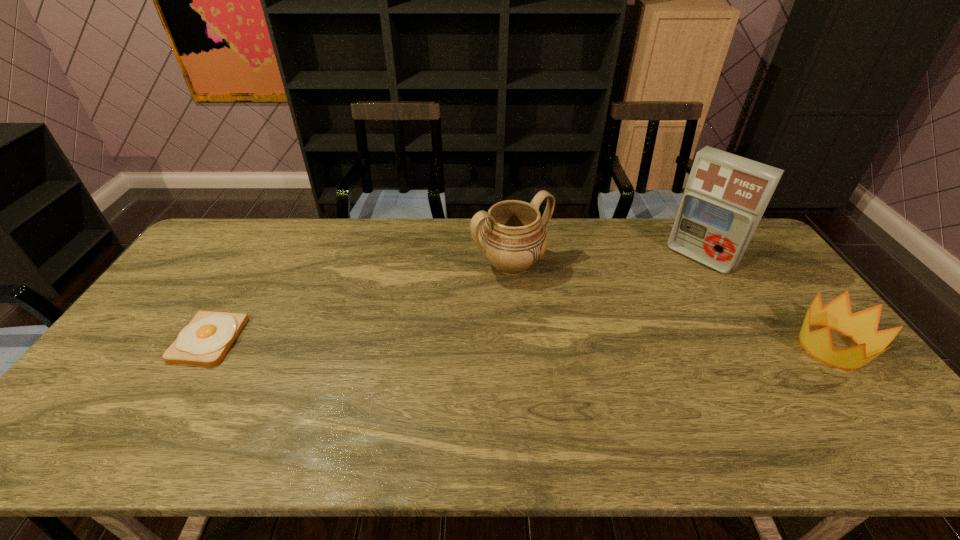
I want to click on empty space that is in between the crown and the third object from left to right, so click(x=766, y=302).

Image resolution: width=960 pixels, height=540 pixels. Find the location of `vacant space that's between the urn and the crown`. vacant space that's between the urn and the crown is located at coordinates click(x=671, y=306).

The height and width of the screenshot is (540, 960). I want to click on free spot between the shortest object and the second object from right to left, so click(454, 299).

Where is `vacant area that lies between the second object from right to left and the rightmost object`? This screenshot has height=540, width=960. vacant area that lies between the second object from right to left and the rightmost object is located at coordinates (766, 302).

At what (x,y) coordinates should I click in order to perform the action: click on free space between the shortest object and the tallest object. Please return your answer as a coordinate pair (x, y). Looking at the image, I should click on (454, 299).

The width and height of the screenshot is (960, 540). Find the location of `the closest object relative to the tallest object`. the closest object relative to the tallest object is located at coordinates (862, 326).

Find the location of a particular element. This screenshot has width=960, height=540. object that is the third closest to the third tallest object is located at coordinates (205, 341).

Where is `vacant space that satisfies the following two spatial constraints: 1. on the back side of the shortest object; 2. on the left side of the urn`? vacant space that satisfies the following two spatial constraints: 1. on the back side of the shortest object; 2. on the left side of the urn is located at coordinates (254, 265).